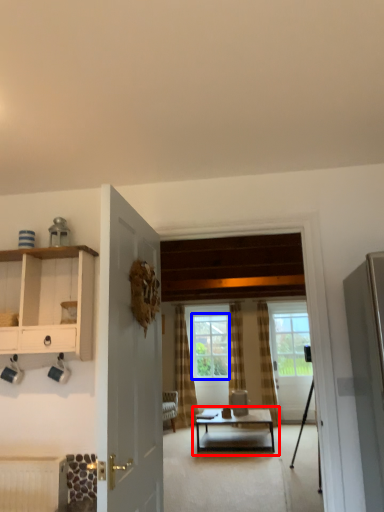
Question: Which object is further to the camera taking this photo, coffee table (highlighted by a red box) or window (highlighted by a blue box)?

Choices:
 (A) coffee table
 (B) window

Answer: (B)